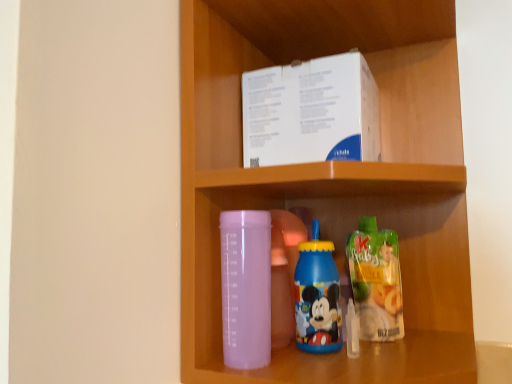
Question: Is blue plastic bottle at center, the 2th bottle in the left-to-right sequence, positioned far away from translucent plastic juice at lower right, placed as the third bottle when sorted from left to right?

Choices:
 (A) yes
 (B) no

Answer: (B)

Question: Considering the relative positions of blue plastic bottle at center, which is counted as the 2th bottle, starting from the right, and translucent plastic juice at lower right, which is the 1th bottle in right-to-left order, in the image provided, is blue plastic bottle at center, which is counted as the 2th bottle, starting from the right, to the left of translucent plastic juice at lower right, which is the 1th bottle in right-to-left order, from the viewer's perspective?

Choices:
 (A) yes
 (B) no

Answer: (A)

Question: Considering the relative positions of blue plastic bottle at center, the 2th bottle in the left-to-right sequence, and translucent plastic juice at lower right, which is the 1th bottle in right-to-left order, in the image provided, is blue plastic bottle at center, the 2th bottle in the left-to-right sequence, behind translucent plastic juice at lower right, which is the 1th bottle in right-to-left order,?

Choices:
 (A) no
 (B) yes

Answer: (A)

Question: Is blue plastic bottle at center, the 2th bottle in the left-to-right sequence, not within translucent plastic juice at lower right, which is the 1th bottle in right-to-left order?

Choices:
 (A) no
 (B) yes

Answer: (B)

Question: Considering the relative sizes of blue plastic bottle at center, which is counted as the 2th bottle, starting from the right, and translucent plastic juice at lower right, which is the 1th bottle in right-to-left order, in the image provided, is blue plastic bottle at center, which is counted as the 2th bottle, starting from the right, shorter than translucent plastic juice at lower right, which is the 1th bottle in right-to-left order,?

Choices:
 (A) no
 (B) yes

Answer: (A)

Question: Is blue plastic bottle at center, which is counted as the 2th bottle, starting from the right, positioned before translucent plastic juice at lower right, placed as the third bottle when sorted from left to right?

Choices:
 (A) no
 (B) yes

Answer: (B)

Question: Is there a large distance between translucent plastic juice at lower right, which is the 1th bottle in right-to-left order, and matte plastic bottle at lower center?

Choices:
 (A) no
 (B) yes

Answer: (A)

Question: Can you confirm if translucent plastic juice at lower right, placed as the third bottle when sorted from left to right, is smaller than matte plastic bottle at lower center?

Choices:
 (A) no
 (B) yes

Answer: (B)

Question: From the image's perspective, is translucent plastic juice at lower right, which is the 1th bottle in right-to-left order, on matte plastic bottle at lower center?

Choices:
 (A) yes
 (B) no

Answer: (B)

Question: Does translucent plastic juice at lower right, placed as the third bottle when sorted from left to right, have a greater width compared to matte plastic bottle at lower center?

Choices:
 (A) no
 (B) yes

Answer: (A)

Question: Can you confirm if translucent plastic juice at lower right, which is the 1th bottle in right-to-left order, is positioned to the left of matte plastic bottle at lower center?

Choices:
 (A) no
 (B) yes

Answer: (A)

Question: Considering the relative positions of translucent plastic juice at lower right, which is the 1th bottle in right-to-left order, and matte plastic bottle at lower center in the image provided, is translucent plastic juice at lower right, which is the 1th bottle in right-to-left order, to the right of matte plastic bottle at lower center from the viewer's perspective?

Choices:
 (A) no
 (B) yes

Answer: (B)

Question: Is transparent plastic bottle at center, the third bottle positioned from the right, wider than translucent plastic juice at lower right, which is the 1th bottle in right-to-left order?

Choices:
 (A) no
 (B) yes

Answer: (B)